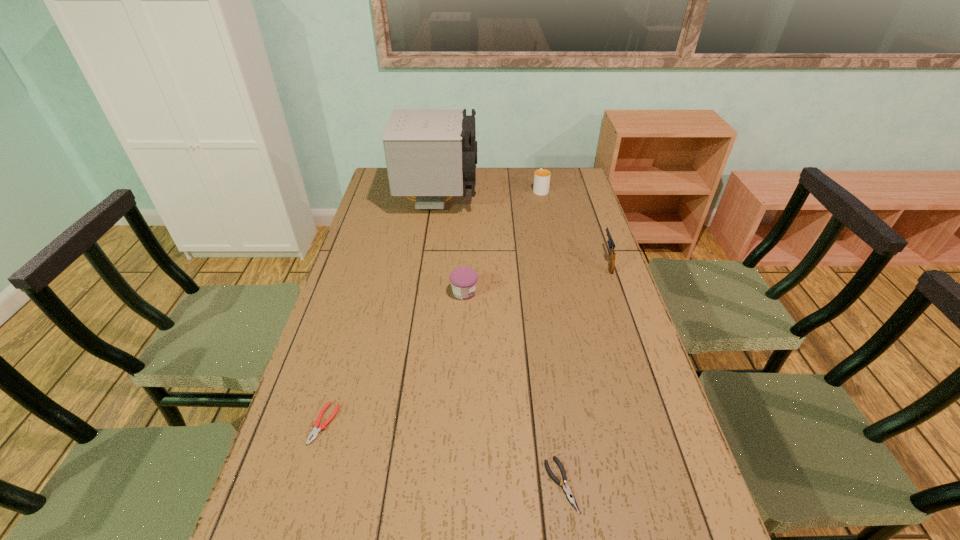
Where is `free spot between the gun and the fourth object from left to right`? Image resolution: width=960 pixels, height=540 pixels. free spot between the gun and the fourth object from left to right is located at coordinates (584, 373).

Find the location of a particular element. blank region between the tallest object and the jam is located at coordinates point(451,247).

The width and height of the screenshot is (960, 540). What are the coordinates of `object that is the fifth closest to the second object from right to left` in the screenshot? It's located at (315, 431).

Locate an element on the screen. This screenshot has width=960, height=540. object that stands as the closest to the third object from right to left is located at coordinates (315, 431).

Locate an element on the screen. vacant region that satisfies the following two spatial constraints: 1. on the front label of the third shortest object; 2. on the right side of the right pliers is located at coordinates pos(457,484).

Identify the location of free space that satisfies the following two spatial constraints: 1. on the front label of the fourth object from left to right; 2. on the right side of the fourth tallest object. The image size is (960, 540). (457, 484).